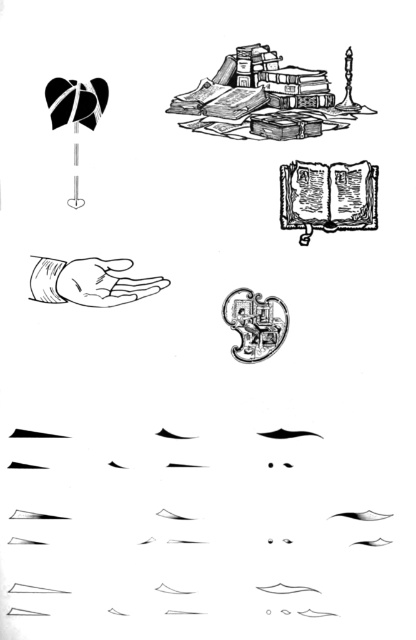
You are an archaeologist holding a 12 inch long measuring rod. You need to determine if the distance between the stacked books at upper center and the shiny metallic key at center is within your rod length. Can you confirm?

The distance between the stacked books at upper center and the shiny metallic key at center is 10.09 inches, which is shorter than the 12 inch measuring rod. Therefore, the distance is within the rod length.

You are standing at point (264, 60). You need to reach a point that is 3.47 feet away from you. Is there an object at that distance?

Yes, the ornate circular emblem or seal with intricate designs is 3.47 feet away from point (264, 60).

You are examining a black and white illustration with a heart symbol, books, a candlestick, an open hand, and an ornate emblem. You notice two points labeled as point 1 and point 2. Point 1 is at coordinate (225, 67) and point 2 is at (284, 320). Based on their positions in the illustration, which point is closer to you?

Point 1 is closer to the viewer than point 2.